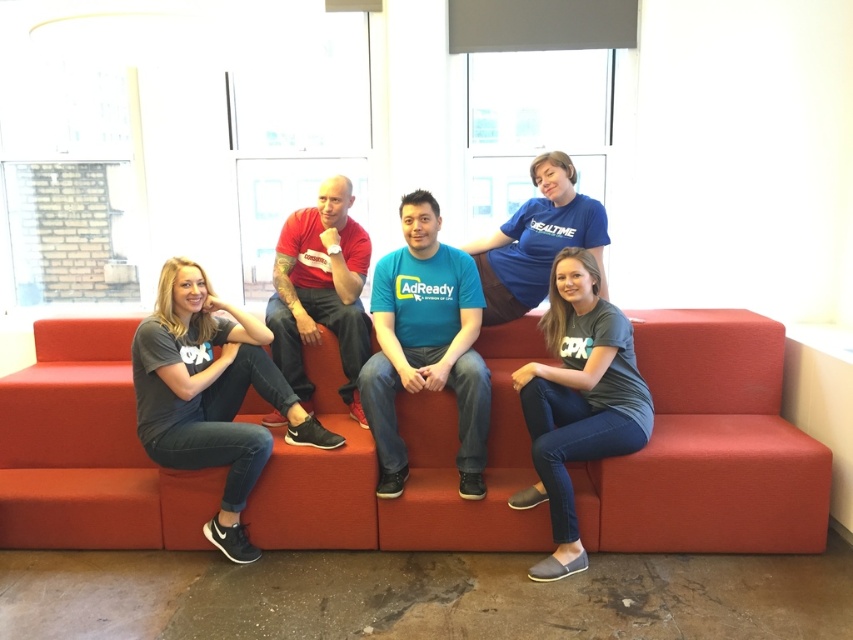
You are a tailor who needs to determine which shirt requires more fabric for alterations. Based on the image, which shirt between the gray fabric shirt at left and the blue cotton shirt at center requires more fabric for alterations?

The gray fabric shirt at left requires more fabric for alterations because its width is larger than the blue cotton shirt at center.

You are a photographer setting up a shoot in the office. You need to ensure that the blue fabric shirt at center and the blue cotton shirt at center are visible in the frame. Given their sizes, which shirt might require more careful positioning to avoid being obscured by other elements?

The blue fabric shirt at center has a lesser width compared to the blue cotton shirt at center, so it might require more careful positioning to avoid being obscured since it is smaller in size.

You are a photographer setting up a photo shoot in the scene. You need to ensure that two blue shirts, the blue fabric shirt at center and the blue cotton shirt at center, are positioned at least 18 inches apart for better visibility in the photo. Based on the current setup, do they meet this requirement?

The blue fabric shirt at center and blue cotton shirt at center are currently 17.65 inches apart, which is less than the required 18 inches. Therefore, they do not meet the requirement and need to be moved further apart.